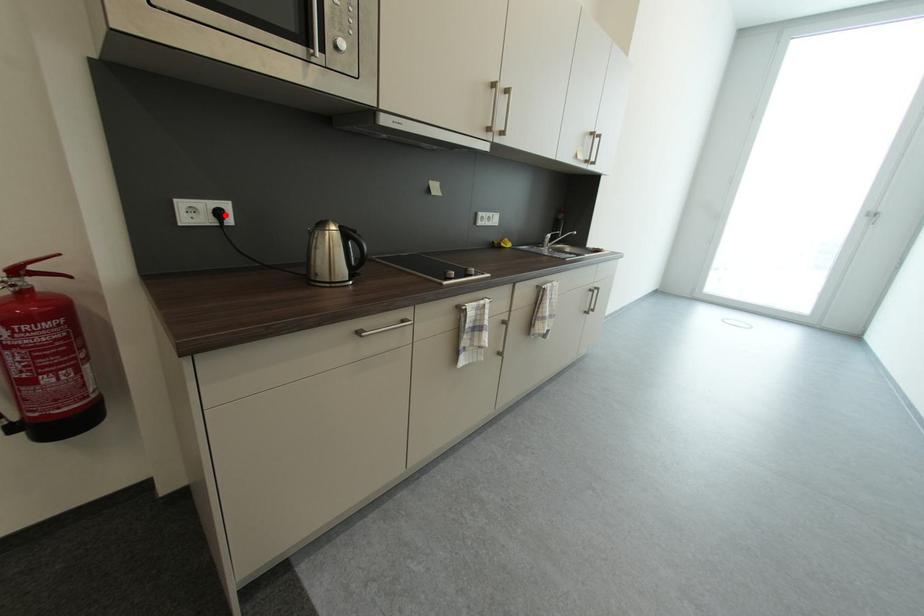
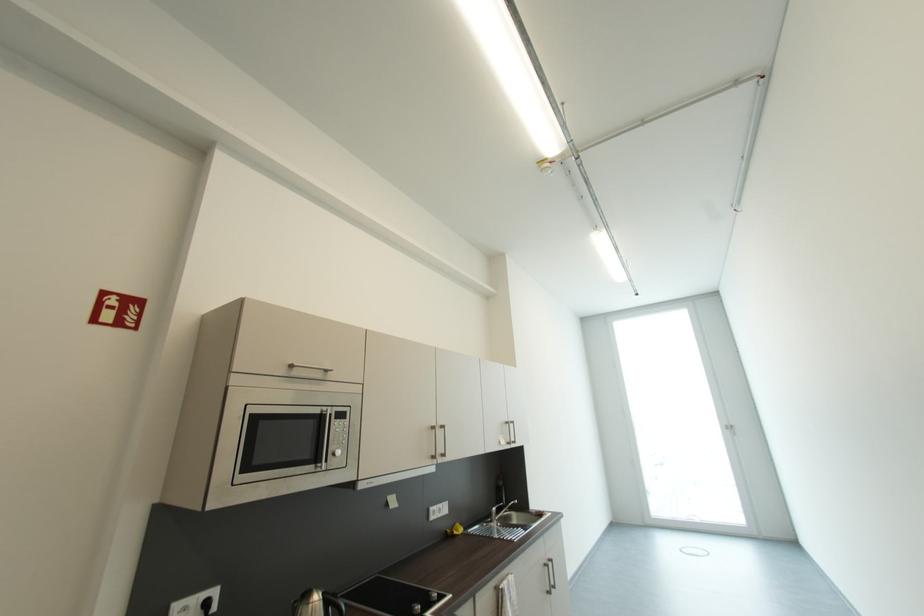
The point at the highlighted location is marked in the first image. Where is the corresponding point in the second image?

(213, 605)